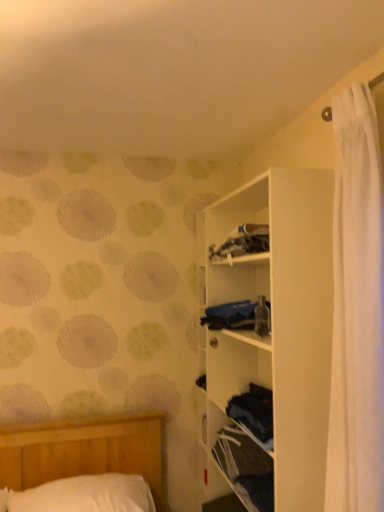
Question: Is blue fabric at center at the right side of white matte shelf at upper right?

Choices:
 (A) yes
 (B) no

Answer: (B)

Question: Can you confirm if blue fabric at center is bigger than white matte shelf at upper right?

Choices:
 (A) no
 (B) yes

Answer: (A)

Question: Can we say blue fabric at center lies outside white matte shelf at upper right?

Choices:
 (A) no
 (B) yes

Answer: (A)

Question: From a real-world perspective, is blue fabric at center beneath white matte shelf at upper right?

Choices:
 (A) yes
 (B) no

Answer: (B)

Question: Does blue fabric at center turn towards white matte shelf at upper right?

Choices:
 (A) yes
 (B) no

Answer: (A)

Question: In the image, is white soft pillow at lower left positioned in front of or behind white matte shelf at upper right?

Choices:
 (A) front
 (B) behind

Answer: (B)

Question: Considering the positions of white soft pillow at lower left and white matte shelf at upper right in the image, is white soft pillow at lower left taller or shorter than white matte shelf at upper right?

Choices:
 (A) short
 (B) tall

Answer: (A)

Question: Considering the positions of point (49, 487) and point (238, 190), is point (49, 487) closer or farther from the camera than point (238, 190)?

Choices:
 (A) closer
 (B) farther

Answer: (A)

Question: Is white soft pillow at lower left inside or outside of white matte shelf at upper right?

Choices:
 (A) inside
 (B) outside

Answer: (B)

Question: In terms of height, does blue fabric at center look taller or shorter compared to white matte shelf at upper right?

Choices:
 (A) tall
 (B) short

Answer: (B)

Question: Which is correct: blue fabric at center is inside white matte shelf at upper right, or outside of it?

Choices:
 (A) inside
 (B) outside

Answer: (A)

Question: Considering their positions, is blue fabric at center located in front of or behind white matte shelf at upper right?

Choices:
 (A) front
 (B) behind

Answer: (B)

Question: From a real-world perspective, is blue fabric at center above or below white matte shelf at upper right?

Choices:
 (A) above
 (B) below

Answer: (A)

Question: From the image's perspective, is white matte shelf at upper right above or below white soft pillow at lower left?

Choices:
 (A) above
 (B) below

Answer: (A)

Question: Is white matte shelf at upper right inside or outside of white soft pillow at lower left?

Choices:
 (A) inside
 (B) outside

Answer: (B)